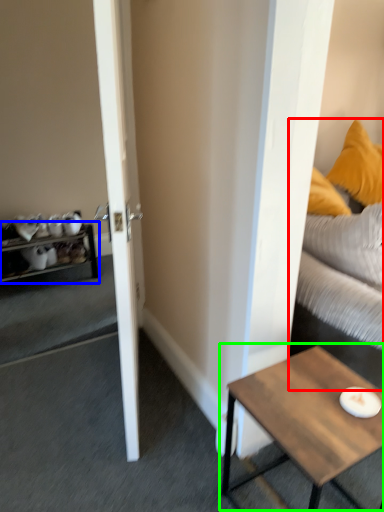
Question: Which object is the farthest from studio couch (highlighted by a red box)? Choose among these: shelf (highlighted by a blue box) or coffee table (highlighted by a green box).

Choices:
 (A) shelf
 (B) coffee table

Answer: (A)